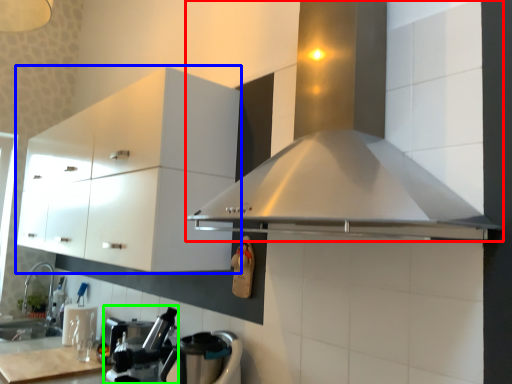
Question: Which object is the farthest from home appliance (highlighted by a red box)? Choose among these: cabinetry (highlighted by a blue box) or coffee machine (highlighted by a green box).

Choices:
 (A) cabinetry
 (B) coffee machine

Answer: (B)